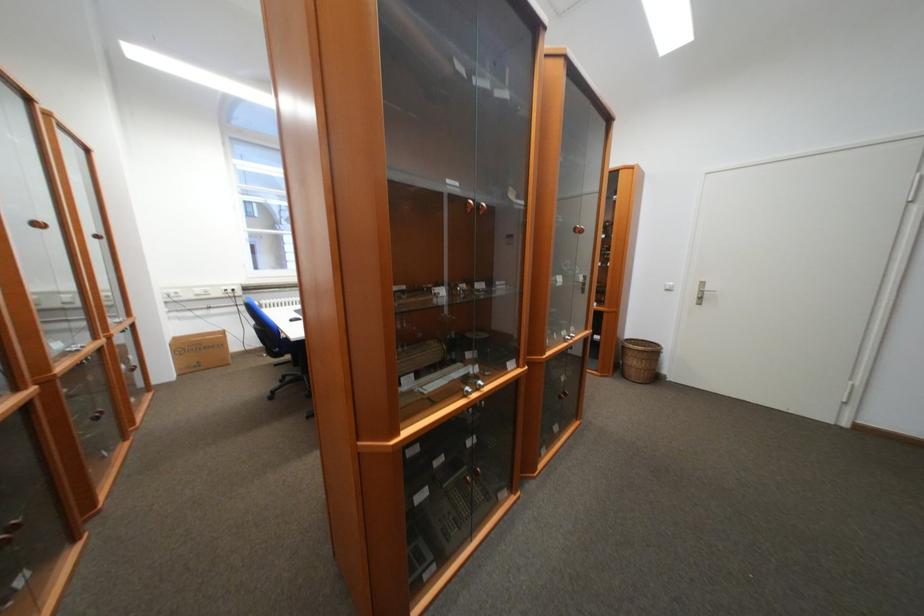
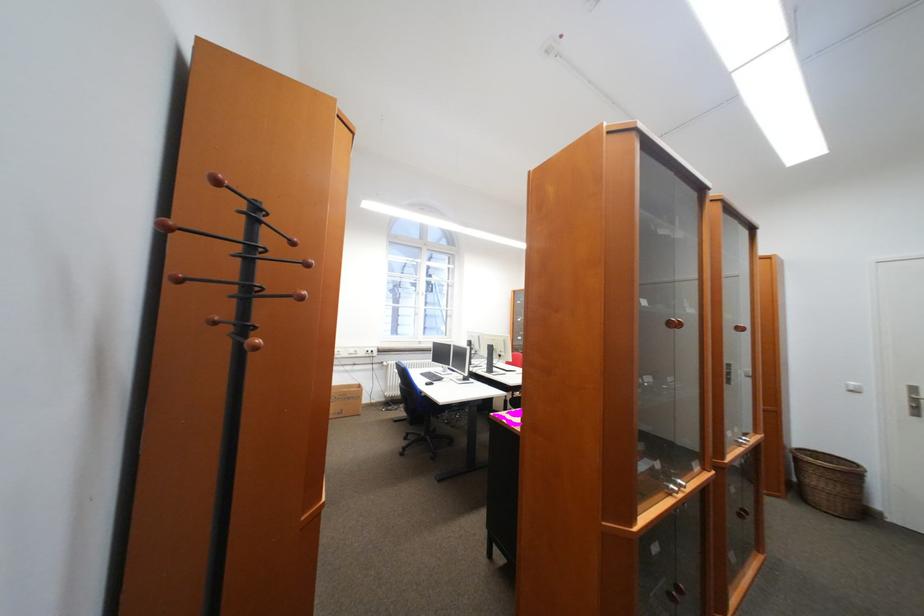
Find the pixel in the second image that matches pixel 640 373 in the first image.

(830, 499)